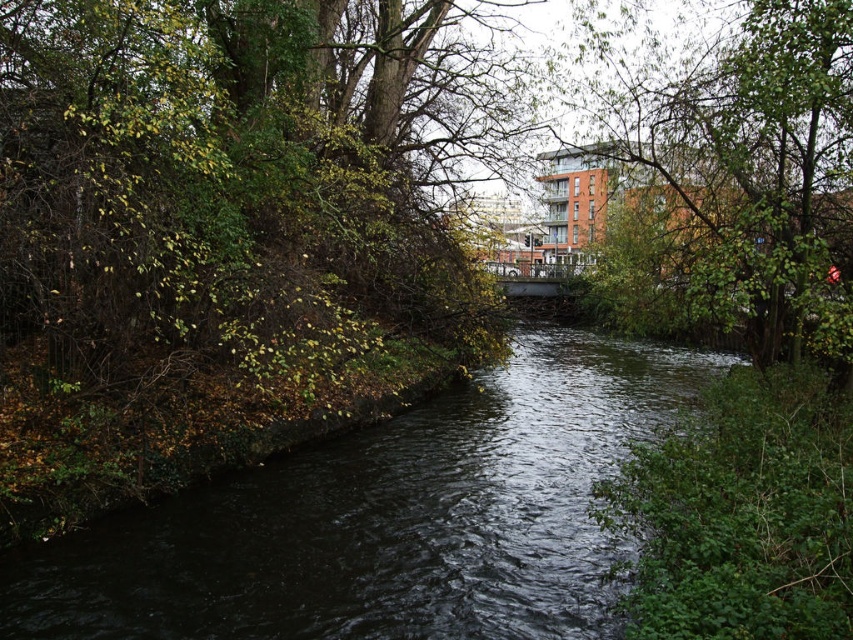
Question: Which point appears closest to the camera in this image?

Choices:
 (A) (416, 509)
 (B) (621, 28)

Answer: (A)

Question: Does dark water at center appear under green leafy tree at upper right?

Choices:
 (A) no
 (B) yes

Answer: (B)

Question: Can you confirm if dark water at center is positioned above green leafy tree at upper right?

Choices:
 (A) yes
 (B) no

Answer: (B)

Question: Does dark water at center have a smaller size compared to green leafy tree at upper right?

Choices:
 (A) no
 (B) yes

Answer: (B)

Question: Which point is farther from the camera taking this photo?

Choices:
 (A) (221, 545)
 (B) (778, 176)

Answer: (B)